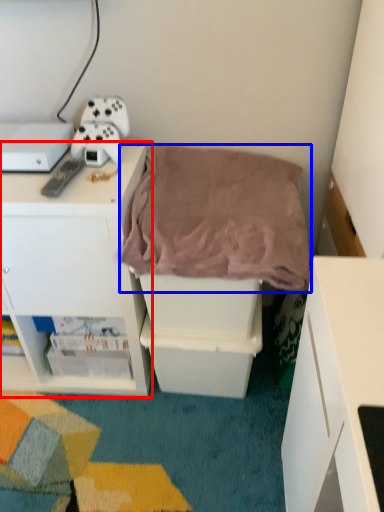
Question: Which point is further to the camera, cabinetry (highlighted by a red box) or blanket (highlighted by a blue box)?

Choices:
 (A) cabinetry
 (B) blanket

Answer: (A)